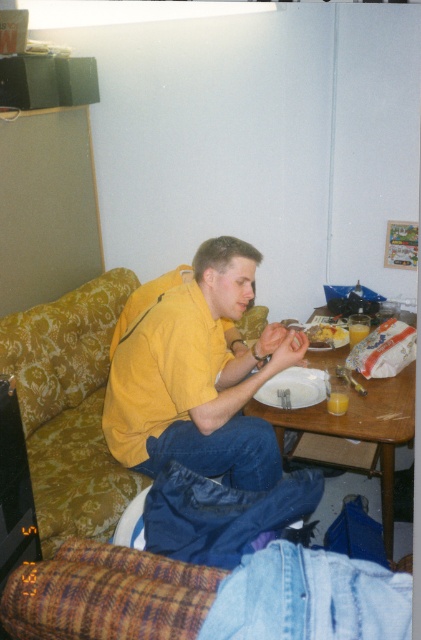
You are a fashion designer observing the image. You need to determine which item has a greater height between the yellow matte shirt at center and the yellowish matte plate at center. Which one is taller?

The yellow matte shirt at center is taller than the yellowish matte plate at center according to the description.

You are a delivery person who needs to place a 5.5 foot long package on the floor near the gold floral fabric couch at left. Is there enough space between you and the couch to place the package without moving any furniture?

The distance between the gold floral fabric couch at left and the viewer is 5.72 feet. Since the package is 5.5 feet long, there is enough space to place it without moving any furniture.